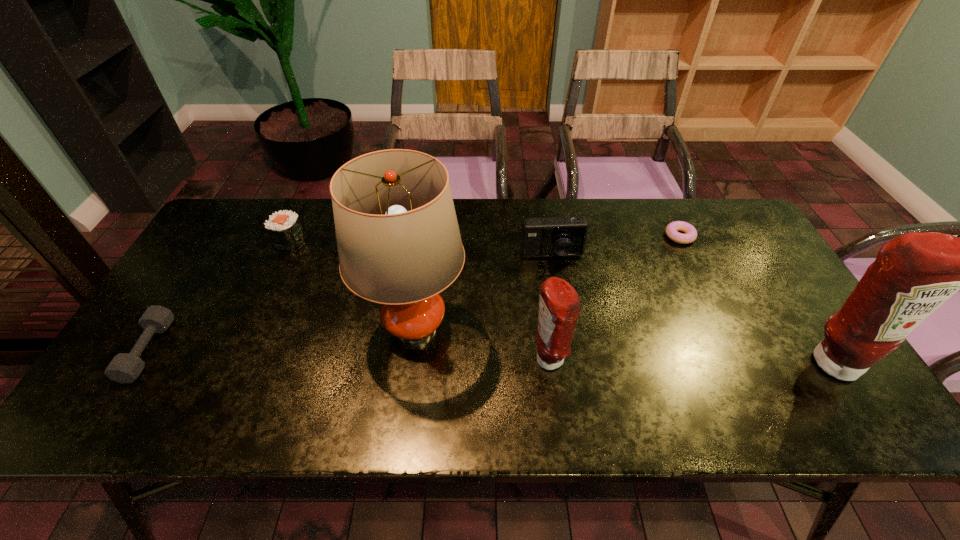
The image size is (960, 540). In the image, there is a desktop. Identify the location of vacant space at the near edge. (276, 377).

Find the location of a particular element. The height and width of the screenshot is (540, 960). vacant space at the left edge of the desktop is located at coordinates (200, 249).

Find the location of `free point at the right edge`. free point at the right edge is located at coordinates (751, 258).

Where is `free space at the far left corner of the desktop`? This screenshot has height=540, width=960. free space at the far left corner of the desktop is located at coordinates (243, 204).

In the image, there is a desktop. What are the coordinates of `vacant space at the near right corner` in the screenshot? It's located at (783, 365).

Where is `free spot between the taller condiment and the lamp`? The image size is (960, 540). free spot between the taller condiment and the lamp is located at coordinates (624, 346).

This screenshot has width=960, height=540. In order to click on empty location between the dumbbell and the third tallest object in this screenshot , I will do `click(348, 355)`.

At what (x,y) coordinates should I click in order to perform the action: click on free space that is in between the second object from left to right and the shortest object. Please return your answer as a coordinate pair (x, y). This screenshot has height=540, width=960. Looking at the image, I should click on (485, 238).

Locate an element on the screen. The image size is (960, 540). free space between the shortest object and the second object from left to right is located at coordinates (485, 238).

At what (x,y) coordinates should I click in order to perform the action: click on vacant space that's between the dumbbell and the tallest object. Please return your answer as a coordinate pair (x, y). Image resolution: width=960 pixels, height=540 pixels. Looking at the image, I should click on (281, 340).